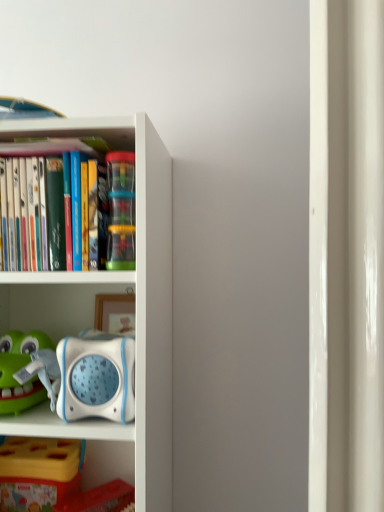
Describe the element at coordinates (39, 472) in the screenshot. The width and height of the screenshot is (384, 512). I see `yellow plastic toy at lower left` at that location.

The height and width of the screenshot is (512, 384). I want to click on yellow plastic toy at lower left, so click(39, 472).

This screenshot has width=384, height=512. Find the location of `yellow plastic toy at lower left`. yellow plastic toy at lower left is located at coordinates (39, 472).

Is white plastic bookcase at left not close to translucent plastic cups at center?

They are positioned close to each other.

Which of these two, white plastic bookcase at left or translucent plastic cups at center, stands taller?

white plastic bookcase at left is taller.

Image resolution: width=384 pixels, height=512 pixels. I want to click on bookcase lying on the left of translucent plastic cups at center, so click(x=114, y=291).

Between white plastic bookcase at left and translucent plastic cups at center, which one has smaller size?

Smaller between the two is translucent plastic cups at center.

Can you see translucent plastic cups at center touching yellow plastic toy at lower left?

No, translucent plastic cups at center is not beside yellow plastic toy at lower left.

Which object is closer to the camera taking this photo, translucent plastic cups at center or yellow plastic toy at lower left?

translucent plastic cups at center.

In the scene shown: How many degrees apart are the facing directions of translucent plastic cups at center and yellow plastic toy at lower left?

The angle between the facing direction of translucent plastic cups at center and the facing direction of yellow plastic toy at lower left is 0.00188 degrees.

Identify the location of toy on the right of yellow plastic toy at lower left. point(121,210).

Is translucent plastic cups at center positioned before white plastic bookcase at left?

No.

Consider the image. Which point is more forward, (132, 158) or (65, 430)?

The point (65, 430) is in front.

Between translucent plastic cups at center and white plastic bookcase at left, which one has smaller width?

translucent plastic cups at center.

Is white plastic bookcase at left not near yellow plastic toy at lower left?

No, white plastic bookcase at left is in close proximity to yellow plastic toy at lower left.

From the picture: From their relative heights in the image, would you say white plastic bookcase at left is taller or shorter than yellow plastic toy at lower left?

Considering their sizes, white plastic bookcase at left has more height than yellow plastic toy at lower left.

From a real-world perspective, who is located lower, white plastic bookcase at left or yellow plastic toy at lower left?

From a 3D spatial view, yellow plastic toy at lower left is below.

What's the angular difference between yellow plastic toy at lower left and white plastic bookcase at left's facing directions?

The angle between the facing direction of yellow plastic toy at lower left and the facing direction of white plastic bookcase at left is 0.904 degrees.

Is yellow plastic toy at lower left turned away from white plastic bookcase at left?

Yes, yellow plastic toy at lower left is positioned with its back facing white plastic bookcase at left.

Which is in front, point (61, 486) or point (26, 281)?

Point (26, 281)

Is the depth of yellow plastic toy at lower left less than that of white plastic bookcase at left?

No, it is not.

The image size is (384, 512). Identify the location of toy lying on the right of yellow plastic toy at lower left. tap(121, 210).

Is yellow plastic toy at lower left positioned with its back to translucent plastic cups at center?

No, yellow plastic toy at lower left is not facing the opposite direction of translucent plastic cups at center.

Can you confirm if yellow plastic toy at lower left is bigger than translucent plastic cups at center?

Correct, yellow plastic toy at lower left is larger in size than translucent plastic cups at center.

In terms of height, does yellow plastic toy at lower left look taller or shorter compared to translucent plastic cups at center?

In the image, yellow plastic toy at lower left appears to be shorter than translucent plastic cups at center.

Find the location of a particular element. toy that appears behind the white plastic bookcase at left is located at coordinates (121, 210).

At what (x,y) coordinates should I click in order to perform the action: click on shelf lying on the left of translucent plastic cups at center. Please return your answer as a coordinate pair (x, y). Looking at the image, I should click on (39, 472).

Looking at the image, which one is located further to white plastic bookcase at left, translucent plastic cups at center or yellow plastic toy at lower left?

yellow plastic toy at lower left is positioned further to the anchor white plastic bookcase at left.

Which object lies further to the anchor point white plastic bookcase at left, yellow plastic toy at lower left or translucent plastic cups at center?

Among the two, yellow plastic toy at lower left is located further to white plastic bookcase at left.

Which object lies further to the anchor point yellow plastic toy at lower left, translucent plastic cups at center or white plastic bookcase at left?

translucent plastic cups at center lies further to yellow plastic toy at lower left than the other object.

From the image, which object appears to be nearer to yellow plastic toy at lower left, white plastic bookcase at left or translucent plastic cups at center?

white plastic bookcase at left is positioned closer to the anchor yellow plastic toy at lower left.

Looking at the image, which one is located closer to translucent plastic cups at center, white plastic bookcase at left or yellow plastic toy at lower left?

white plastic bookcase at left is positioned closer to the anchor translucent plastic cups at center.

When comparing their distances from translucent plastic cups at center, does yellow plastic toy at lower left or white plastic bookcase at left seem closer?

Among the two, white plastic bookcase at left is located nearer to translucent plastic cups at center.

Locate an element on the screen. This screenshot has width=384, height=512. bookcase between translucent plastic cups at center and yellow plastic toy at lower left from top to bottom is located at coordinates (114, 291).